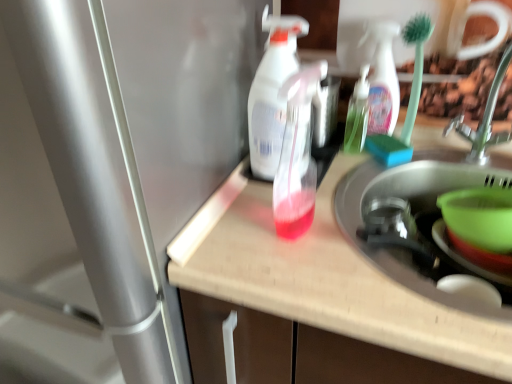
Question: Considering the relative sizes of translucent plastic spray bottle at center, the second bottle in the back-to-front sequence, and translucent plastic bottle at center in the image provided, is translucent plastic spray bottle at center, the second bottle in the back-to-front sequence, taller than translucent plastic bottle at center?

Choices:
 (A) no
 (B) yes

Answer: (A)

Question: Is the surface of translucent plastic spray bottle at center, the second bottle in the back-to-front sequence, in direct contact with translucent plastic bottle at center?

Choices:
 (A) no
 (B) yes

Answer: (A)

Question: From the image's perspective, is translucent plastic spray bottle at center, marked as the 1th bottle in a front-to-back arrangement, below translucent plastic bottle at center?

Choices:
 (A) no
 (B) yes

Answer: (A)

Question: Could you tell me if translucent plastic spray bottle at center, marked as the 1th bottle in a front-to-back arrangement, is turned towards translucent plastic bottle at center?

Choices:
 (A) yes
 (B) no

Answer: (B)

Question: Can you confirm if translucent plastic spray bottle at center, the 1th bottle in the left-to-right sequence, is thinner than translucent plastic bottle at center?

Choices:
 (A) yes
 (B) no

Answer: (A)

Question: Does translucent plastic spray bottle at center, which appears as the second bottle when viewed from the right, have a lesser height compared to translucent plastic bottle at center?

Choices:
 (A) no
 (B) yes

Answer: (B)

Question: Is translucent plastic spray bottle at center, which appears as the second bottle when viewed from the right, far from green plastic bowl at sink right?

Choices:
 (A) yes
 (B) no

Answer: (B)

Question: Is the position of translucent plastic spray bottle at center, which appears as the second bottle when viewed from the right, more distant than that of green plastic bowl at sink right?

Choices:
 (A) no
 (B) yes

Answer: (A)

Question: Does translucent plastic spray bottle at center, marked as the 1th bottle in a front-to-back arrangement, appear on the left side of green plastic bowl at sink right?

Choices:
 (A) no
 (B) yes

Answer: (B)

Question: Is translucent plastic spray bottle at center, which appears as the second bottle when viewed from the right, to the right of green plastic bowl at sink right from the viewer's perspective?

Choices:
 (A) yes
 (B) no

Answer: (B)

Question: From the image's perspective, is translucent plastic spray bottle at center, the second bottle in the back-to-front sequence, below green plastic bowl at sink right?

Choices:
 (A) yes
 (B) no

Answer: (B)

Question: Is the depth of translucent plastic spray bottle at center, the 1th bottle in the left-to-right sequence, less than that of green plastic bowl at sink right?

Choices:
 (A) no
 (B) yes

Answer: (B)

Question: Can you confirm if metallic silver faucet at upper right is bigger than translucent plastic spray bottle at center, the 1th bottle in the left-to-right sequence?

Choices:
 (A) no
 (B) yes

Answer: (B)